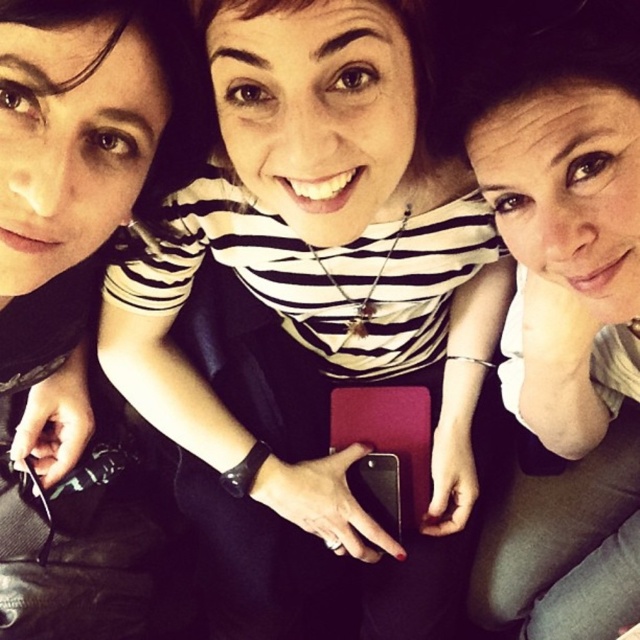
You are taking a selfie with your friends. Your phone is at point [634,17]. The camera is 23.16 inches away from this point. Is the camera close enough to capture everyone in the frame?

The camera is 23.16 inches away from point [634,17], so yes, it is close enough to capture everyone in the frame since the distance is within a typical selfie range.

Consider the image. You are trying to take a picture of the matte black shirt at upper left but the matte black phone at center is blocking your view. Can you move the phone to the left to get a clear shot?

The matte black phone at center is positioned on the right side of the matte black shirt at upper left, so moving it to the left would place it further away from the shirt, allowing you to get a clear shot of the matte black shirt at upper left.